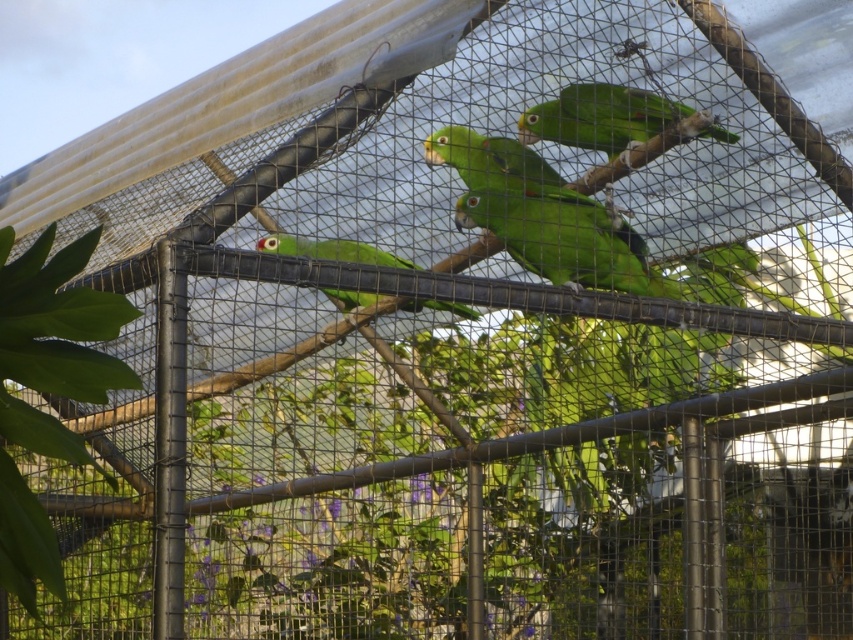
Between green matte parrot at upper center and green matte parrot at center, which one has less height?

Standing shorter between the two is green matte parrot at upper center.

Who is more forward, [630,124] or [256,250]?

Point [630,124] is more forward.

This screenshot has width=853, height=640. Identify the location of green matte parrot at upper center. (599, 116).